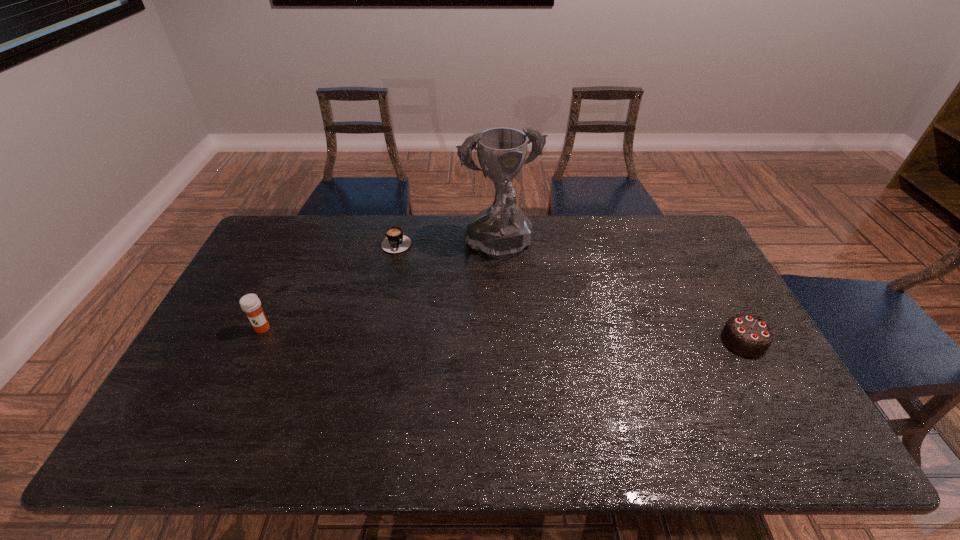
The image size is (960, 540). I want to click on free space located 0.150m on the side with emblem of the second object from right to left, so click(x=528, y=311).

Where is `vacant area situated 0.230m on the side with emblem of the second object from right to left`? The width and height of the screenshot is (960, 540). vacant area situated 0.230m on the side with emblem of the second object from right to left is located at coordinates (538, 332).

Locate an element on the screen. The height and width of the screenshot is (540, 960). vacant space located 0.190m on the side with emblem of the second object from right to left is located at coordinates (533, 321).

What are the coordinates of `blank space located with the handle on the side of the cappuccino` in the screenshot? It's located at (417, 271).

Locate an element on the screen. The height and width of the screenshot is (540, 960). blank area located with the handle on the side of the cappuccino is located at coordinates (415, 267).

Find the location of a particular element. The width and height of the screenshot is (960, 540). free space located with the handle on the side of the cappuccino is located at coordinates click(x=433, y=291).

Identify the location of award present at the far edge. (502, 230).

Where is `cappuccino that is at the far edge`? This screenshot has height=540, width=960. cappuccino that is at the far edge is located at coordinates (396, 242).

You are a GUI agent. You are given a task and a screenshot of the screen. Output one action in this format:
    pyautogui.click(x=<x>, y=<y>)
    Task: Click on the object located at the left edge
    This screenshot has width=960, height=540.
    Given the screenshot: What is the action you would take?
    pyautogui.click(x=250, y=303)

Find the location of a particular element. object located in the right edge section of the desktop is located at coordinates (750, 336).